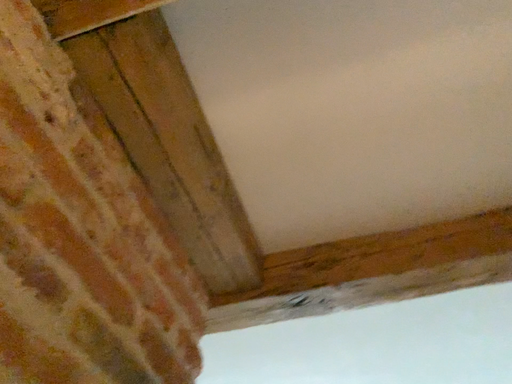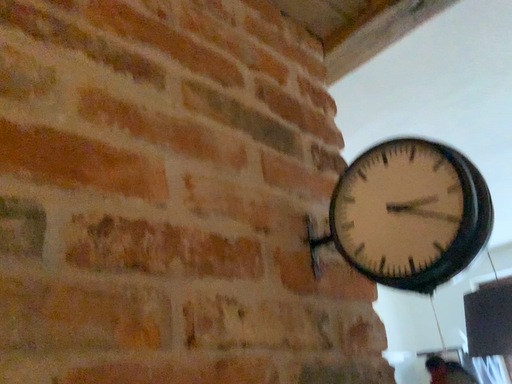
Question: Which way did the camera rotate in the video?

Choices:
 (A) rotated downward
 (B) rotated upward

Answer: (A)